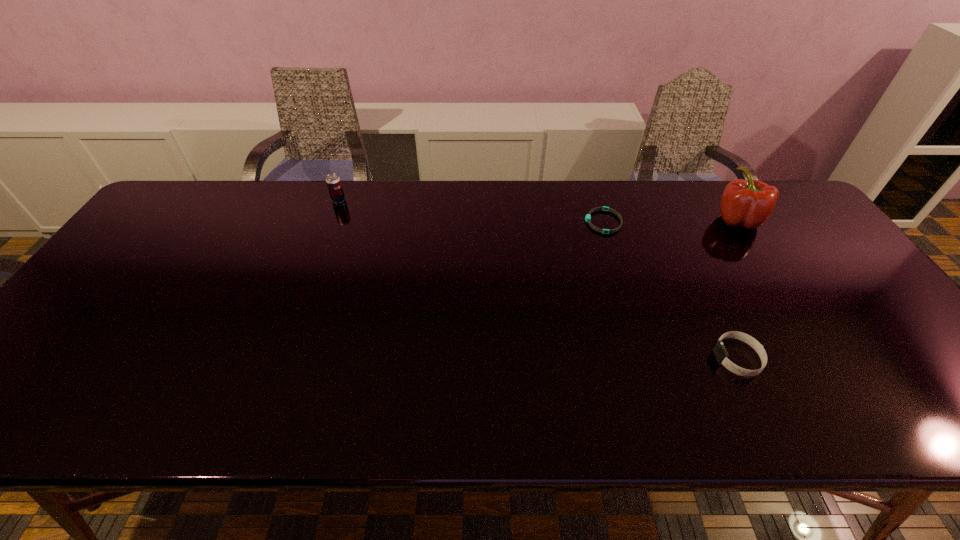
At what (x,y) coordinates should I click in order to perform the action: click on the tallest object. Please return your answer as a coordinate pair (x, y). This screenshot has width=960, height=540. Looking at the image, I should click on (749, 203).

Find the location of `the rightmost object`. the rightmost object is located at coordinates (749, 203).

Where is `the second tallest object`? the second tallest object is located at coordinates (333, 181).

At what (x,y) coordinates should I click in order to perform the action: click on beer can. Please return your answer as a coordinate pair (x, y). Looking at the image, I should click on (333, 181).

The image size is (960, 540). Identify the location of the second object from right to left. (719, 350).

The width and height of the screenshot is (960, 540). I want to click on the second shortest object, so click(x=719, y=350).

What are the coordinates of `the shorter wristband` in the screenshot? It's located at tap(588, 217).

Identify the location of the shortest object. The width and height of the screenshot is (960, 540). (588, 217).

Locate an element on the screen. The image size is (960, 540). vacant space located 0.080m on the back of the tallest object is located at coordinates (718, 190).

Locate an element on the screen. vacant space located on the right of the third shortest object is located at coordinates (376, 200).